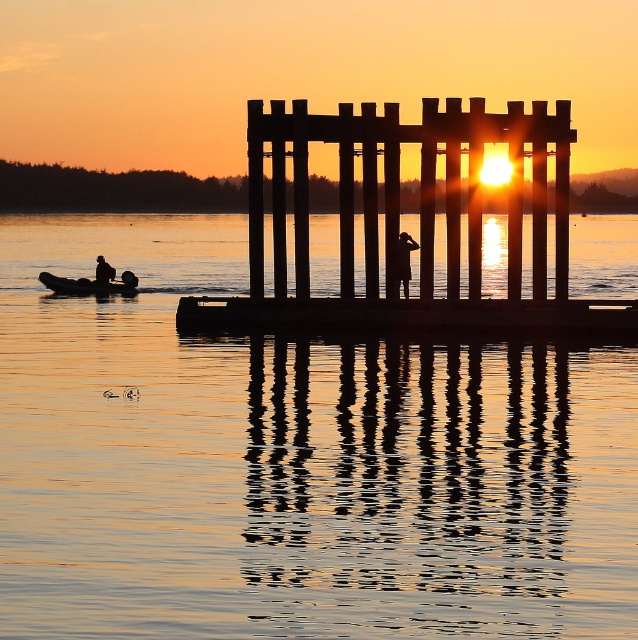
Does wooden at center have a greater height compared to silhouette figure at center?

Yes, wooden at center is taller than silhouette figure at center.

At what (x,y) coordinates should I click in order to perform the action: click on wooden at center. Please return your answer as a coordinate pair (x, y). The width and height of the screenshot is (638, 640). Looking at the image, I should click on (419, 188).

This screenshot has width=638, height=640. I want to click on wooden at center, so click(x=419, y=188).

Is silhouette figure at center shorter than silhouette figure at left?

Incorrect, silhouette figure at center's height does not fall short of silhouette figure at left's.

Is the position of silhouette figure at center more distant than that of silhouette figure at left?

No, silhouette figure at center is closer to the viewer.

Is point (404, 234) behind point (98, 259)?

That is False.

The height and width of the screenshot is (640, 638). I want to click on silhouette figure at center, so click(401, 262).

Measure the distance between wooden at center and camera.

A distance of 34.34 meters exists between wooden at center and camera.

Identify the location of wooden at center. (419, 188).